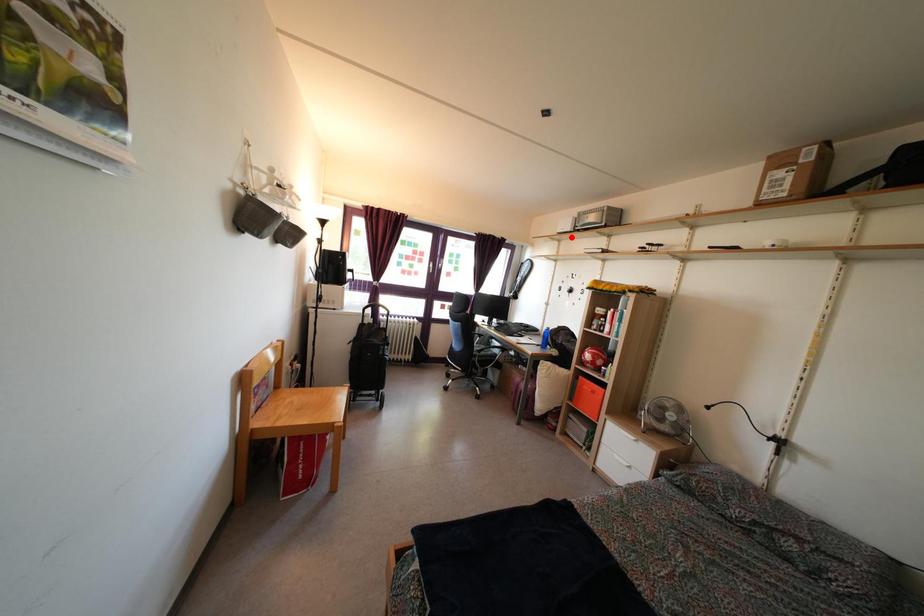
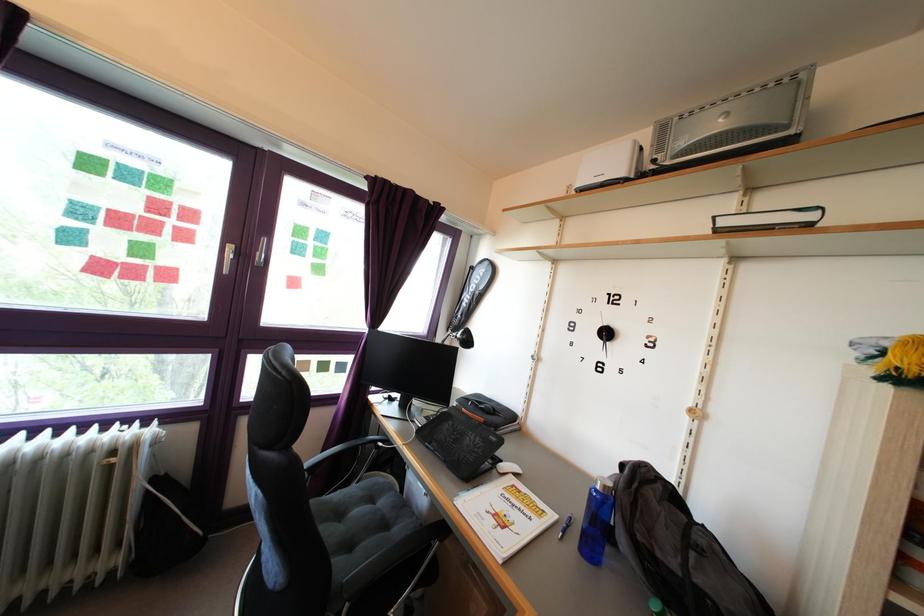
Question: I am providing you with two images of the same scene from different viewpoints. A red point is marked on the first image. Is the red point's position out of view in image 2?

Choices:
 (A) Yes
 (B) No

Answer: (B)